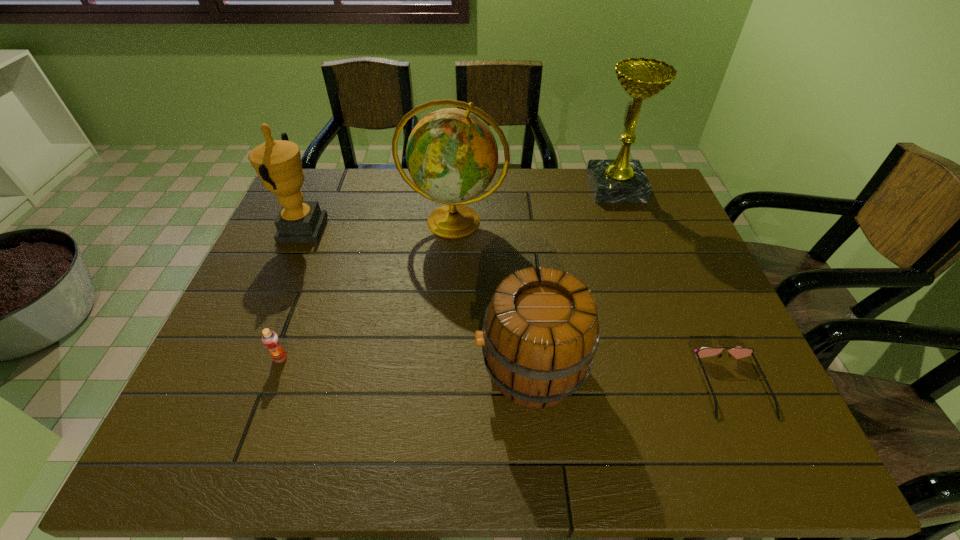
Locate an element on the screen. free space located on the left of the globe is located at coordinates (291, 221).

Where is `blank area located at the front of the nearer award with handles`? The height and width of the screenshot is (540, 960). blank area located at the front of the nearer award with handles is located at coordinates (449, 230).

Image resolution: width=960 pixels, height=540 pixels. I want to click on vacant area situated on the side of the third shortest object where the spigot is located, so click(x=321, y=369).

In order to click on free space located 0.260m on the side of the third shortest object where the spigot is located in this screenshot , I will do `click(357, 369)`.

At what (x,y) coordinates should I click in order to perform the action: click on vacant space situated 0.210m on the side of the third shortest object where the spigot is located. Please return your answer as a coordinate pair (x, y). Image resolution: width=960 pixels, height=540 pixels. Looking at the image, I should click on (380, 369).

The width and height of the screenshot is (960, 540). I want to click on free space located 0.180m on the front of the orange juice, so (x=249, y=444).

In order to click on vacant space located on the bridge of the sunglasses in this screenshot , I will do `click(758, 445)`.

Locate an element on the screen. globe that is at the far edge is located at coordinates (452, 156).

In order to click on object at the near edge in this screenshot , I will do `click(738, 352)`.

This screenshot has height=540, width=960. I want to click on award present at the left edge, so click(x=278, y=163).